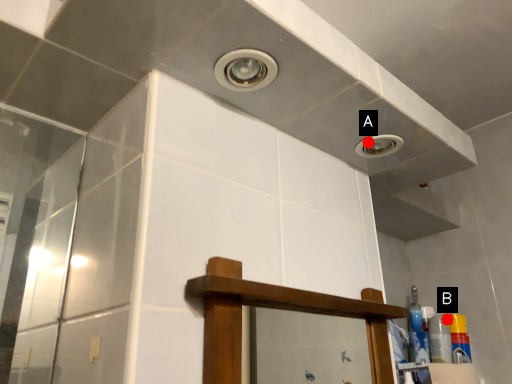
Question: Two points are circled on the image, labeled by A and B beside each circle. Which point appears closest to the camera in this image?

Choices:
 (A) A is closer
 (B) B is closer

Answer: (A)